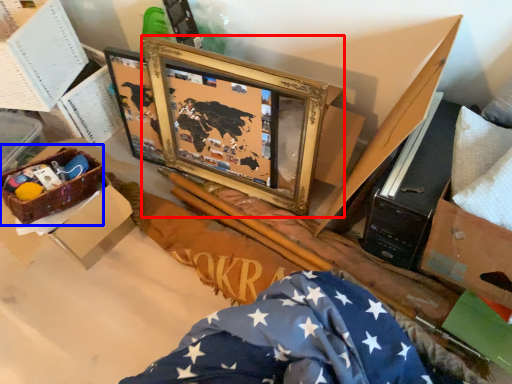
Question: Which object is closer to the camera taking this photo, picture frame (highlighted by a red box) or crate (highlighted by a blue box)?

Choices:
 (A) picture frame
 (B) crate

Answer: (A)